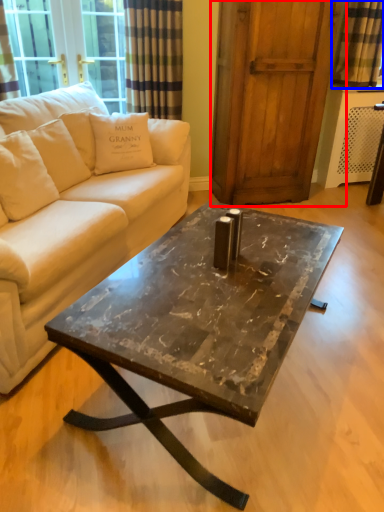
Question: Among these objects, which one is farthest to the camera, screen door (highlighted by a red box) or curtain (highlighted by a blue box)?

Choices:
 (A) screen door
 (B) curtain

Answer: (B)